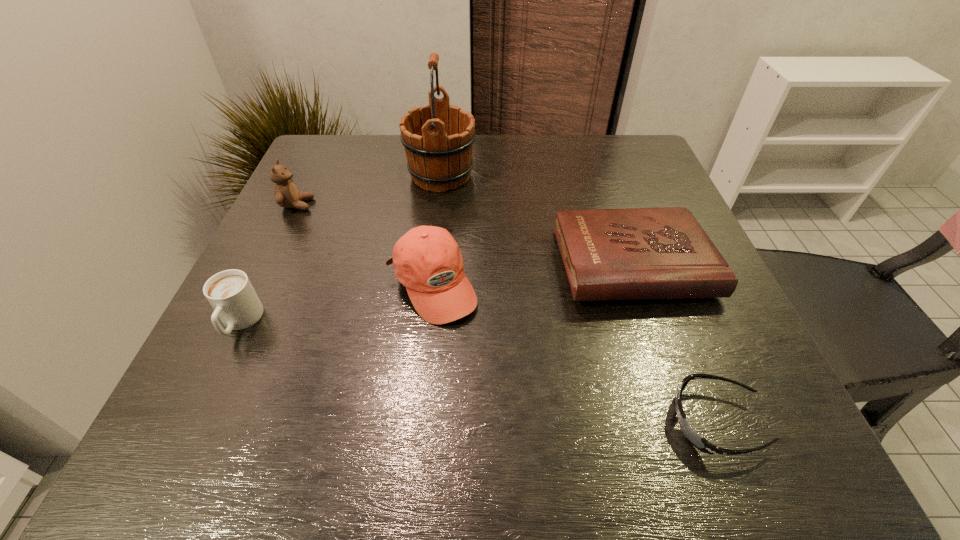
Where is `free space that satisfies the following two spatial constraints: 1. on the front side of the tallest object; 2. on the left side of the baseball cap`? Image resolution: width=960 pixels, height=540 pixels. free space that satisfies the following two spatial constraints: 1. on the front side of the tallest object; 2. on the left side of the baseball cap is located at coordinates (429, 286).

Locate an element on the screen. vacant region that satisfies the following two spatial constraints: 1. on the front-facing side of the baseball cap; 2. on the left side of the teddy bear is located at coordinates (258, 286).

In order to click on vacant space that satisfies the following two spatial constraints: 1. on the front-facing side of the teddy bear; 2. on the side with the handle of the fourth tallest object in this screenshot , I will do `click(241, 322)`.

Locate an element on the screen. The width and height of the screenshot is (960, 540). vacant space that satisfies the following two spatial constraints: 1. on the front side of the wine bucket; 2. on the left side of the baseball cap is located at coordinates (429, 286).